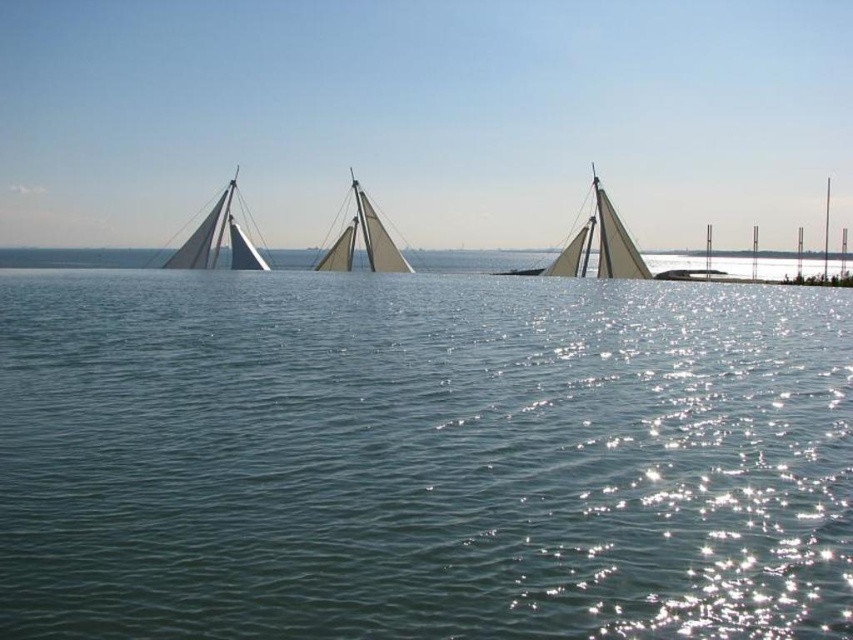
Question: Can you confirm if white matte sailboat at center is bigger than white canvas sailboat at center?

Choices:
 (A) yes
 (B) no

Answer: (A)

Question: Estimate the real-world distances between objects in this image. Which object is closer to the clear blue water at center?

Choices:
 (A) white matte sailboat at center
 (B) white matte sailboat at left
 (C) white canvas sailboat at center

Answer: (A)

Question: Is white matte sailboat at left thinner than white canvas sailboat at center?

Choices:
 (A) yes
 (B) no

Answer: (B)

Question: Is white matte sailboat at center behind white canvas sailboat at center?

Choices:
 (A) no
 (B) yes

Answer: (A)

Question: Which of these objects is positioned farthest from the clear blue water at center?

Choices:
 (A) white canvas sailboat at center
 (B) white matte sailboat at center
 (C) white matte sailboat at left

Answer: (C)

Question: Which point is farther to the camera?

Choices:
 (A) white matte sailboat at left
 (B) clear blue water at center
 (C) white canvas sailboat at center
 (D) white matte sailboat at center

Answer: (A)